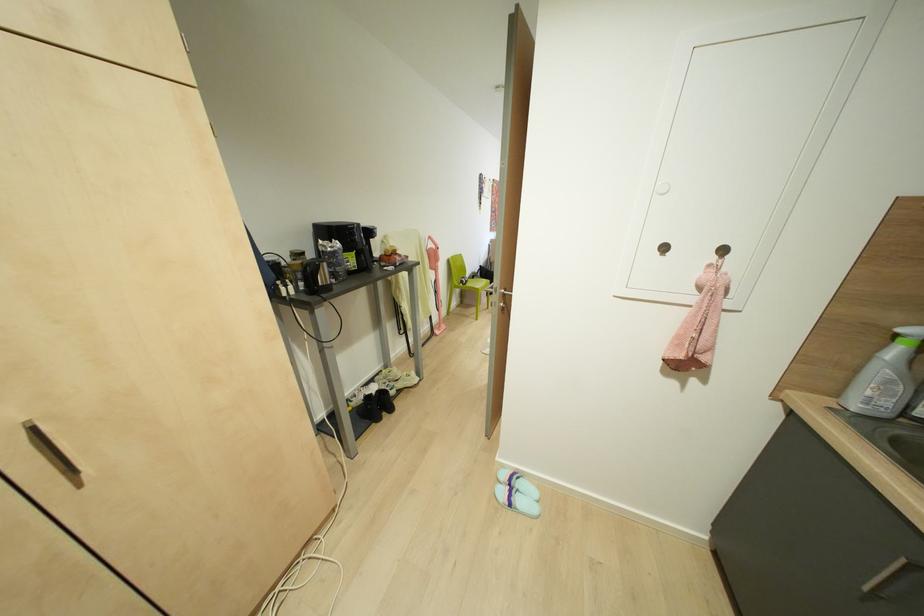
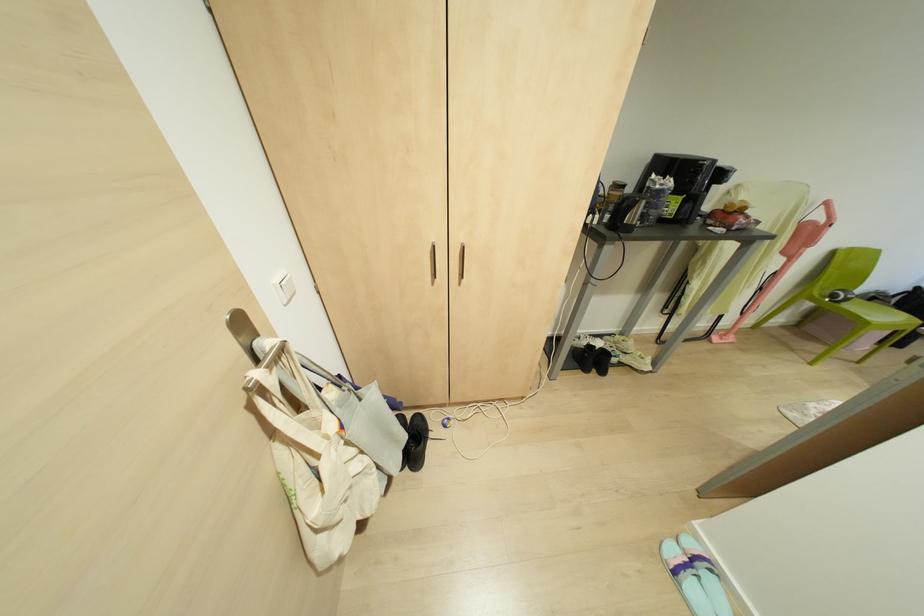
In the second image, find the point that corresponds to point 508,504 in the first image.

(675, 572)